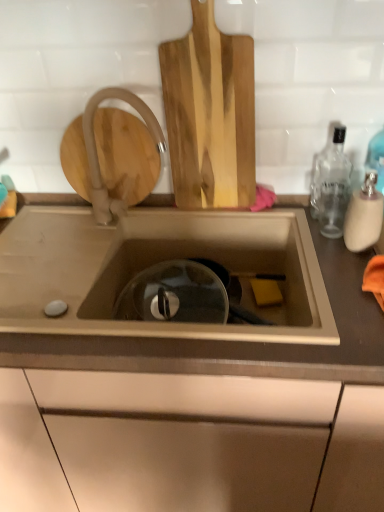
The height and width of the screenshot is (512, 384). Identify the location of free spot in front of translucent glass bottle at right, which appears as the second bottle when viewed from the back. (341, 288).